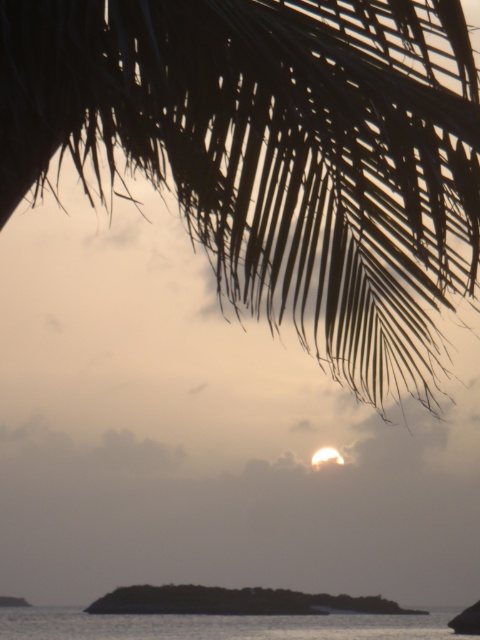
You are an artist trying to paint the sunset scene. You want to place the silky black palm fronds at upper center and the transparent water at lower center accurately. Based on the scene, which object is positioned to the right of the other?

The silky black palm fronds at upper center is to the right of transparent water at lower center.